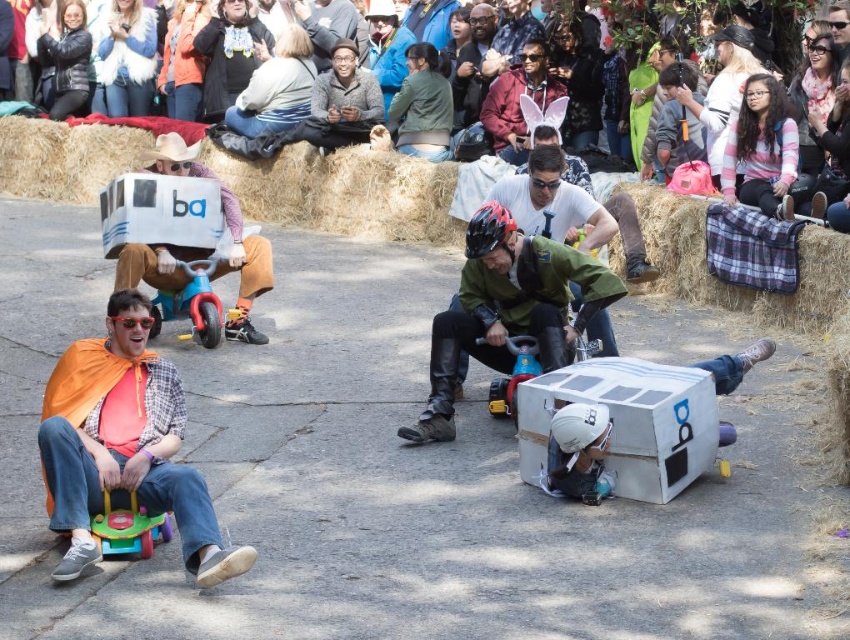
Is matte pink bunny ears at center thinner than matte plastic toy car at center?

No, matte pink bunny ears at center is not thinner than matte plastic toy car at center.

Is matte pink bunny ears at center positioned at the back of matte plastic toy car at center?

Yes, it is behind matte plastic toy car at center.

Measure the distance between point (545,45) and camera.

Point (545,45) and camera are 24.06 meters apart from each other.

Identify the location of matte pink bunny ears at center. The height and width of the screenshot is (640, 850). (518, 100).

Is point (163, 163) positioned before point (34, 156)?

That is True.

From the picture: Between white cardboard box at left and multicolored fabric at upper center, which one appears on the right side from the viewer's perspective?

Positioned to the right is multicolored fabric at upper center.

Who is more forward, (x=244, y=308) or (x=789, y=3)?

Positioned in front is point (x=244, y=308).

Identify the location of white cardboard box at left. (228, 230).

Between matte cardboard box at center and wooden toy at lower left, which one is positioned lower?

Positioned lower is wooden toy at lower left.

Is point (539, 353) farther from viewer compared to point (150, 522)?

Yes.

Does point (511, 365) come farther from viewer compared to point (128, 538)?

Yes.

Where is `matte cardboard box at center`? matte cardboard box at center is located at coordinates (507, 308).